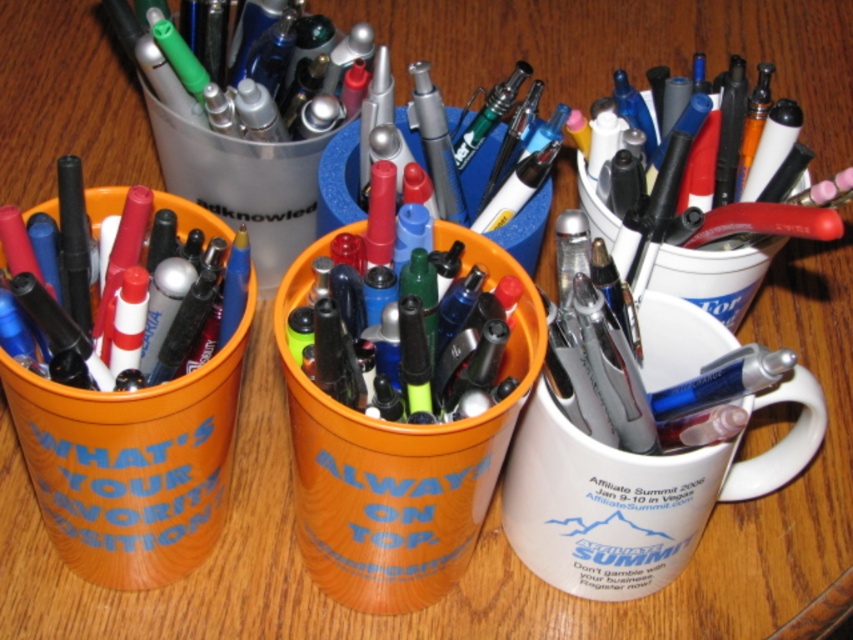
You are organizing a desk and want to place the metallic silver pen at center into the matte plastic cup at left. Can you directly reach the cup without moving any other objects?

The matte plastic cup at left is closer to the viewer than the metallic silver pen at center, so yes, you can directly reach the matte plastic cup at left without moving other objects because it is nearer to you.

You have two mugs to choose from for your coffee. The metallic silver mug at upper center and the white matte mug at right. Which one has a larger diameter at the top?

The white matte mug at right has a larger diameter at the top because the metallic silver mug at upper center is thinner than it.